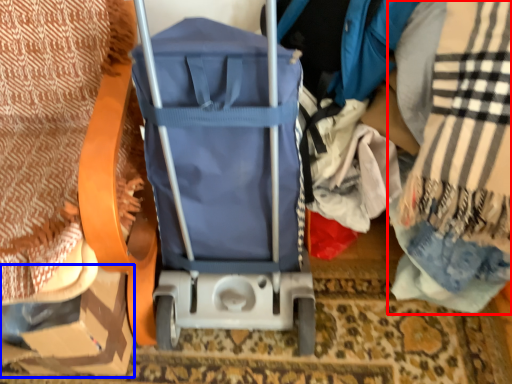
Question: Which object is further to the camera taking this photo, blanket (highlighted by a red box) or cardboard box (highlighted by a blue box)?

Choices:
 (A) blanket
 (B) cardboard box

Answer: (B)